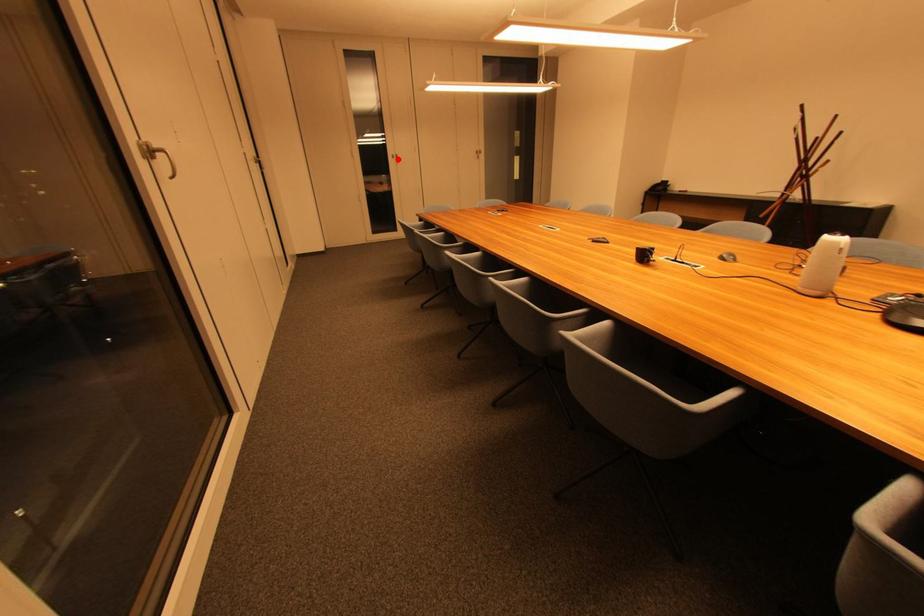
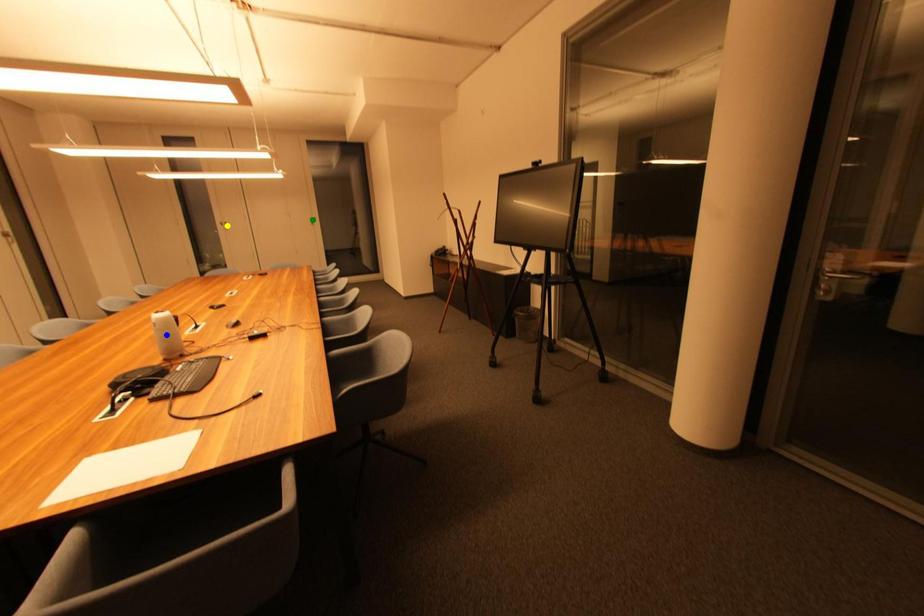
Question: I am providing you with two images of the same scene from different viewpoints. A red point is marked on the first image. You are given multiple points on the second image. Which point in image 2 represents the same 3d spot as the red point in image 1?

Choices:
 (A) blue point
 (B) yellow point
 (C) green point

Answer: (B)